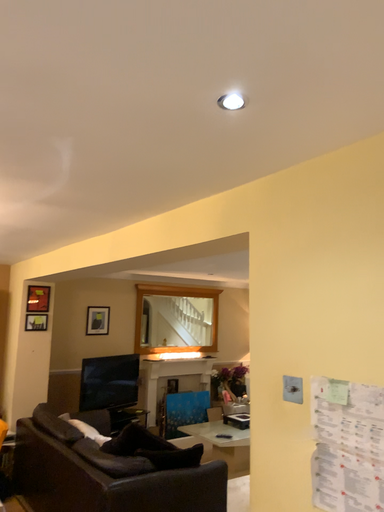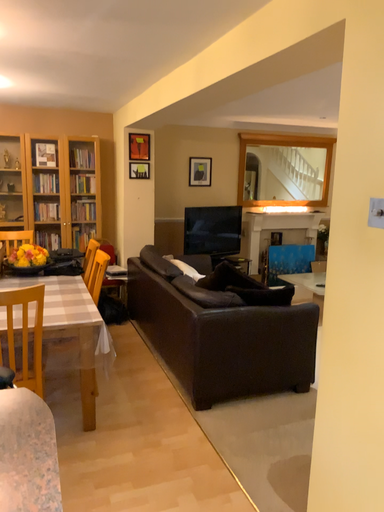
Question: How did the camera likely rotate when shooting the video?

Choices:
 (A) rotated right
 (B) rotated left

Answer: (B)